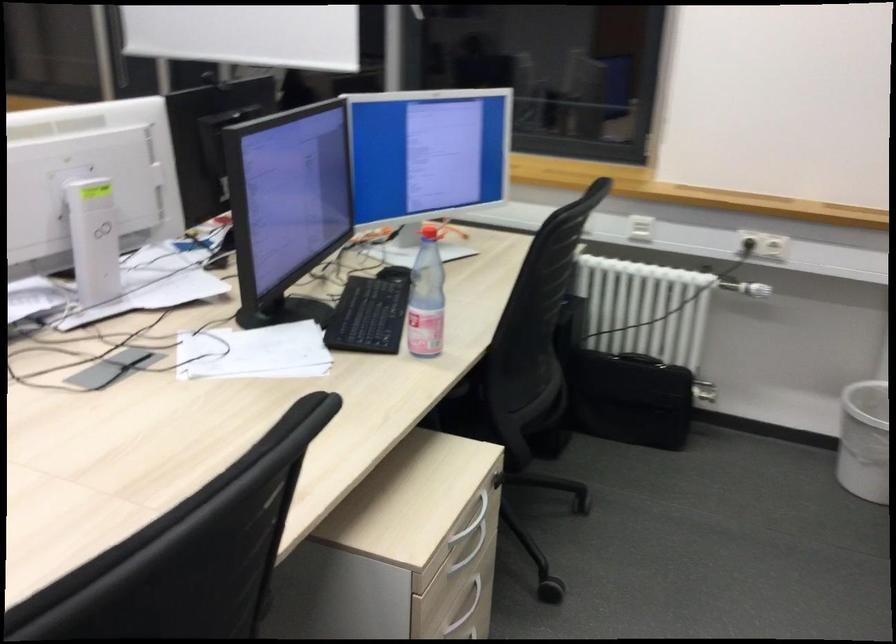
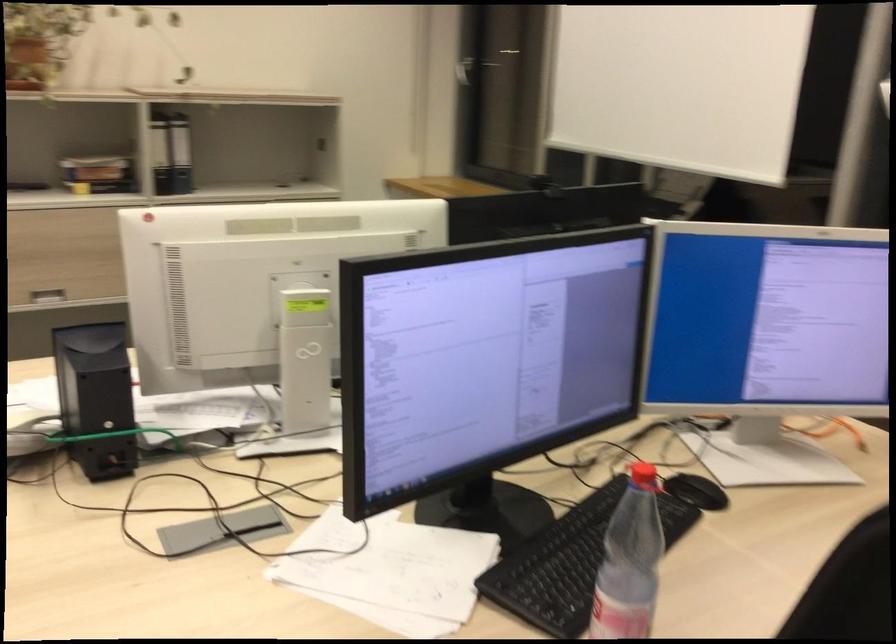
Question: The images are taken continuously from a first-person perspective. In which direction is your viewpoint rotating?

Choices:
 (A) Left
 (B) Right
 (C) Up
 (D) Down

Answer: (A)